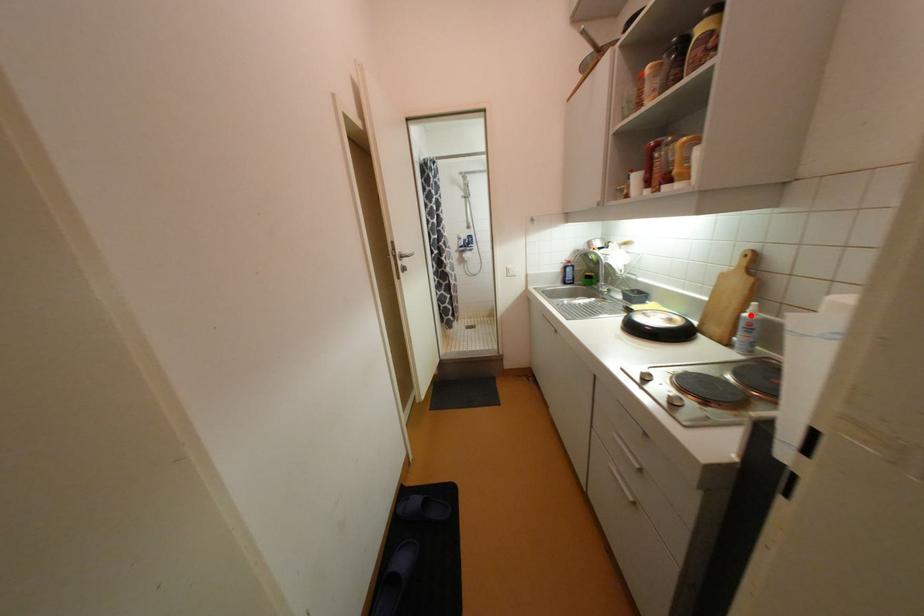
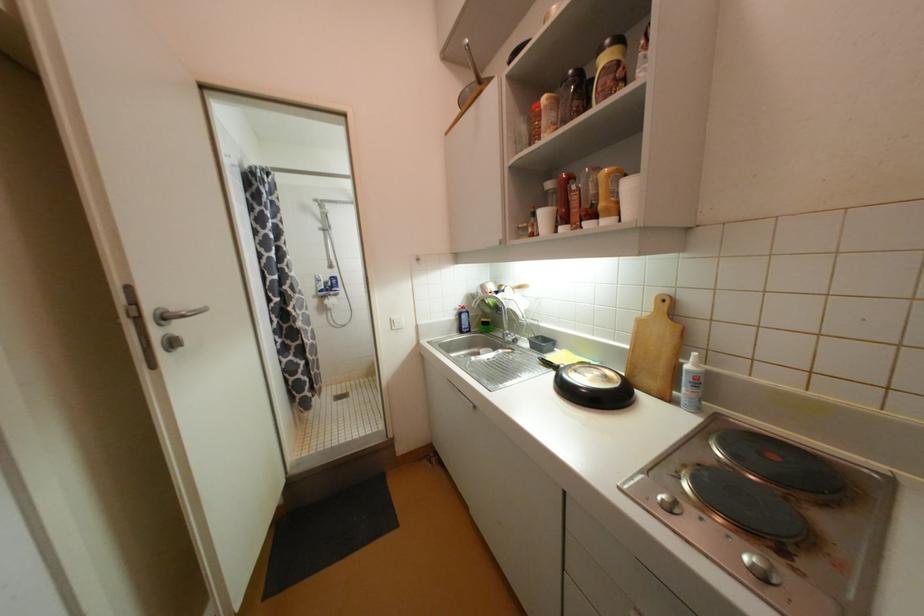
The point at the highlighted location is marked in the first image. Where is the corresponding point in the second image?

(693, 368)